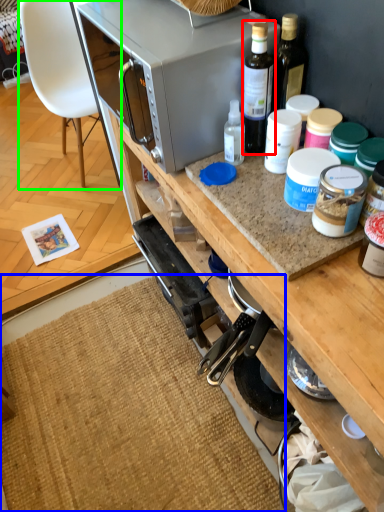
Question: Based on their relative distances, which object is nearer to bottle (highlighted by a red box)? Choose from mat (highlighted by a blue box) and chair (highlighted by a green box).

Choices:
 (A) mat
 (B) chair

Answer: (A)